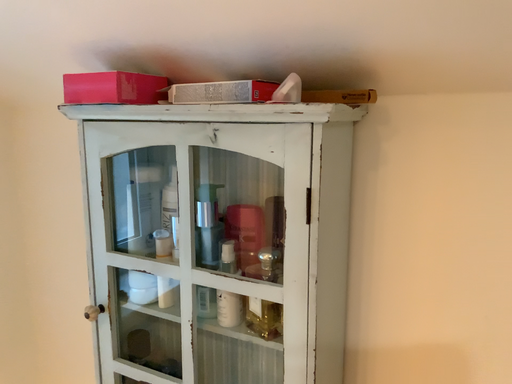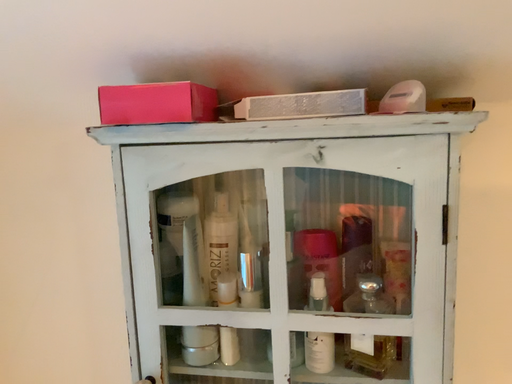
Question: Which way did the camera rotate in the video?

Choices:
 (A) rotated right
 (B) rotated left

Answer: (A)